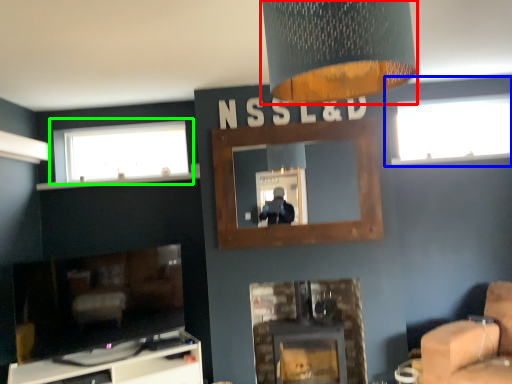
Question: Based on their relative distances, which object is farther from lamp (highlighted by a red box)? Choose from window (highlighted by a blue box) and window (highlighted by a green box).

Choices:
 (A) window
 (B) window

Answer: (A)